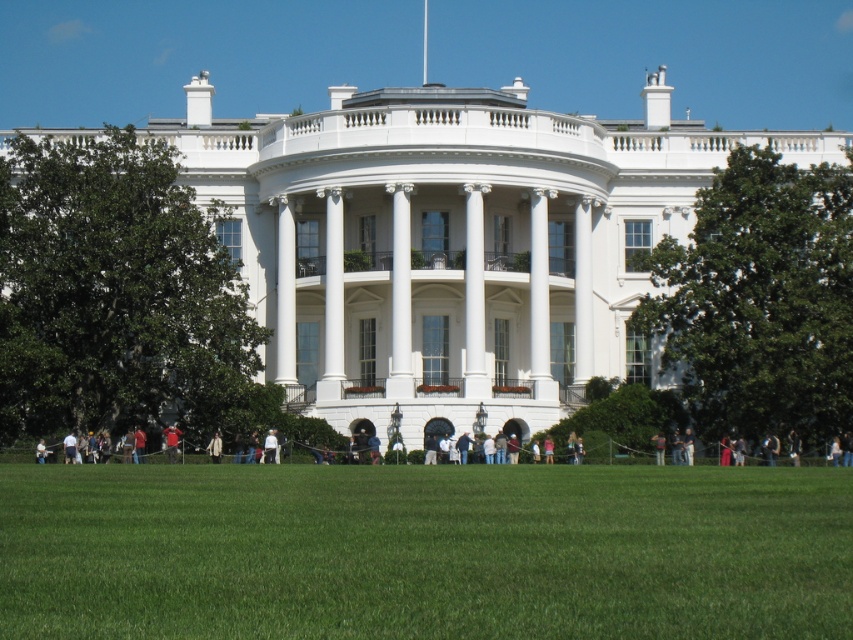
You are a photographer planning to take a portrait of a person wearing both the white cotton shirt at center and the light brown leather jacket at center. Since you want to focus on the clothing details, which item should you zoom in on to ensure it fits within the frame without cropping? Explain your reasoning based on their sizes.

The white cotton shirt at center is wider than the light brown leather jacket at center. To ensure the clothing fits within the frame without cropping, you should zoom in on the light brown leather jacket at center since it is narrower.

You are a photographer standing in front of the White House. You notice a white cotton shirt at center and a camouflage jacket at center. Which item is visible on top?

The white cotton shirt at center is positioned over camouflage jacket at center, so the white cotton shirt at center is visible on top.